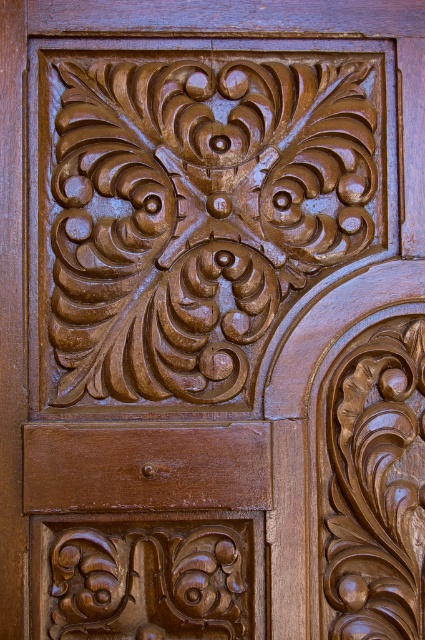
Question: Which object is closer to the camera taking this photo?

Choices:
 (A) matte brown wood at lower center
 (B) brown carved wood at center

Answer: (A)

Question: Is brown carved wood at center below matte brown wood at lower center?

Choices:
 (A) no
 (B) yes

Answer: (A)

Question: Does brown carved wood at center appear under matte brown wood at lower center?

Choices:
 (A) yes
 (B) no

Answer: (B)

Question: Can you confirm if brown carved wood at center is positioned to the left of matte brown wood at lower center?

Choices:
 (A) yes
 (B) no

Answer: (B)